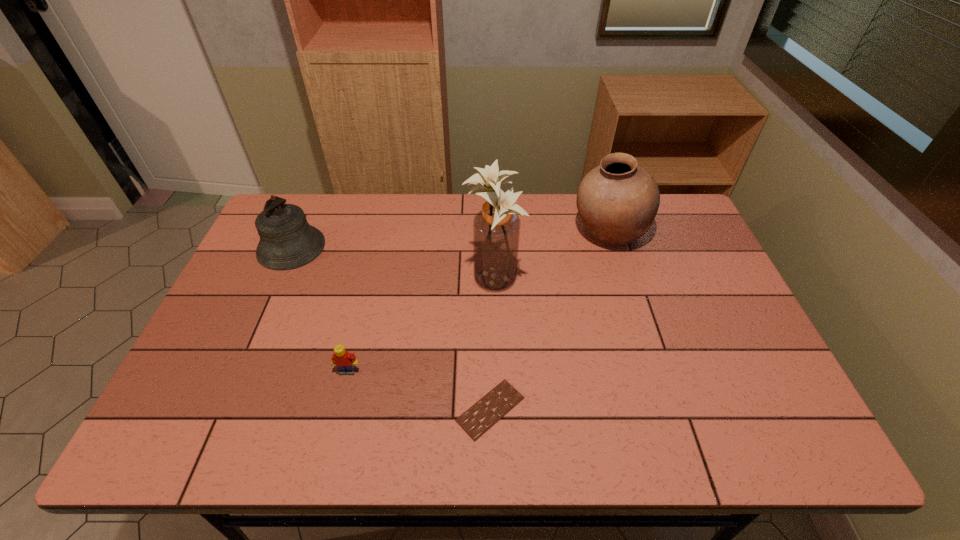
What are the coordinates of `free space located on the back of the rightmost object` in the screenshot? It's located at (598, 195).

Identify the location of vacant space located 0.280m on the front of the leftmost object. (247, 348).

The width and height of the screenshot is (960, 540). In order to click on vacant area situated 0.170m on the front-facing side of the second nearest object in this screenshot , I will do `click(330, 444)`.

Identify the location of vacant space located 0.330m on the left of the chocolate bar. (312, 409).

You are a GUI agent. You are given a task and a screenshot of the screen. Output one action in this format:
    pyautogui.click(x=<x>, y=<y>)
    Task: Click on the pottery that is at the far edge
    The height and width of the screenshot is (540, 960).
    Given the screenshot: What is the action you would take?
    pyautogui.click(x=617, y=201)

Find the location of `bell that is at the far edge`. bell that is at the far edge is located at coordinates (287, 241).

At what (x,y) coordinates should I click in order to perform the action: click on object present at the near edge. Please return your answer as a coordinate pair (x, y). This screenshot has width=960, height=540. Looking at the image, I should click on (479, 418).

Where is `object that is at the left edge`? object that is at the left edge is located at coordinates (287, 241).

Find the location of a particular element. The width and height of the screenshot is (960, 540). object present at the right edge is located at coordinates (617, 201).

Find the location of a particular element. Image resolution: width=960 pixels, height=540 pixels. object that is at the far left corner is located at coordinates (287, 241).